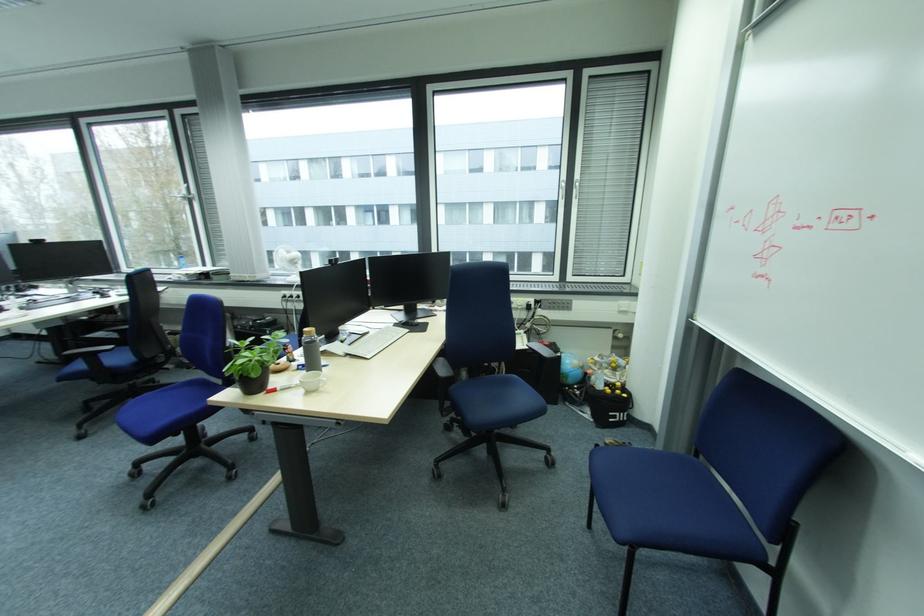
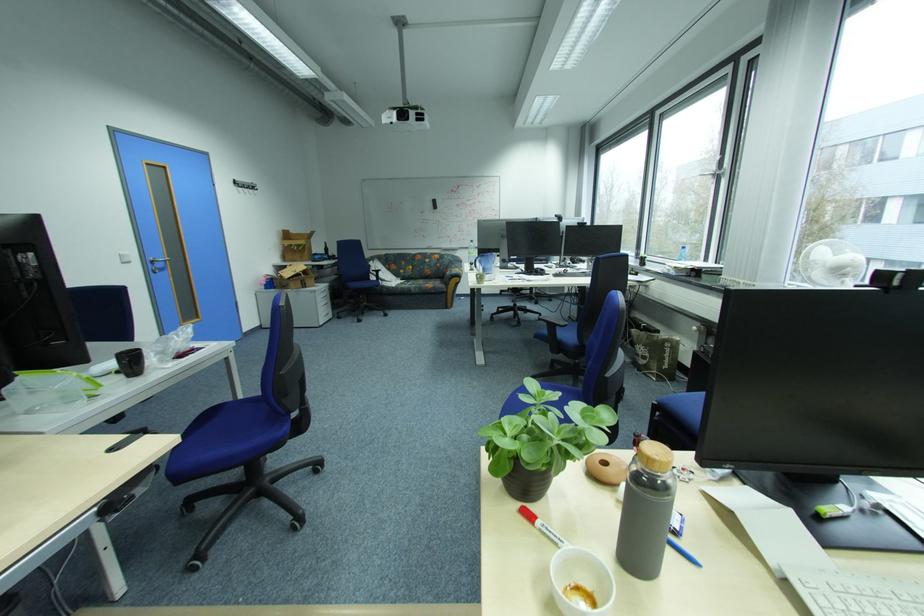
In the second image, find the point that corresponds to (286,390) in the first image.

(546, 525)